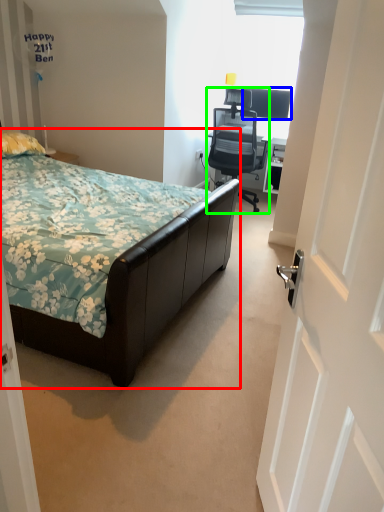
Question: Which is farther away from bed (highlighted by a red box)? television (highlighted by a blue box) or chair (highlighted by a green box)?

Choices:
 (A) television
 (B) chair

Answer: (A)